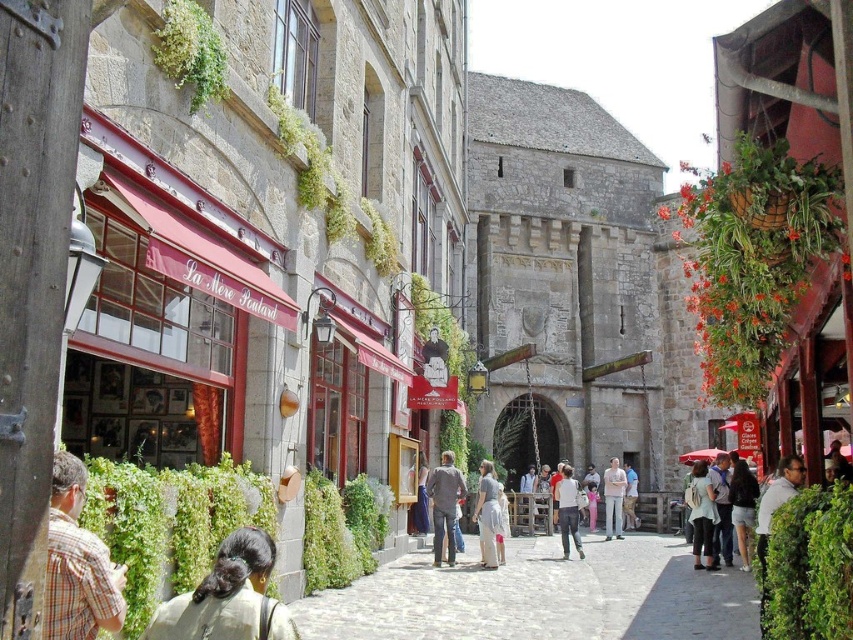
Is the position of dark gray fabric jacket at center less distant than that of denim shorts at lower right?

No, it is behind denim shorts at lower right.

Locate an element on the screen. dark gray fabric jacket at center is located at coordinates (444, 504).

The image size is (853, 640). What are the coordinates of `dark gray fabric jacket at center` in the screenshot? It's located at (444, 504).

Does plaid shirt at lower left have a lesser height compared to dark gray fabric jacket at center?

Yes, plaid shirt at lower left is shorter than dark gray fabric jacket at center.

Between plaid shirt at lower left and dark gray fabric jacket at center, which one has more height?

Standing taller between the two is dark gray fabric jacket at center.

The height and width of the screenshot is (640, 853). What are the coordinates of `plaid shirt at lower left` in the screenshot? It's located at (77, 563).

Is light gray cotton dress at center smaller than light brown leather jacket at center?

No.

Is light gray cotton dress at center to the right of light brown leather jacket at center from the viewer's perspective?

Incorrect, light gray cotton dress at center is not on the right side of light brown leather jacket at center.

Between point (480, 560) and point (635, 500), which one is positioned behind?

Point (635, 500)

I want to click on light gray cotton dress at center, so click(488, 515).